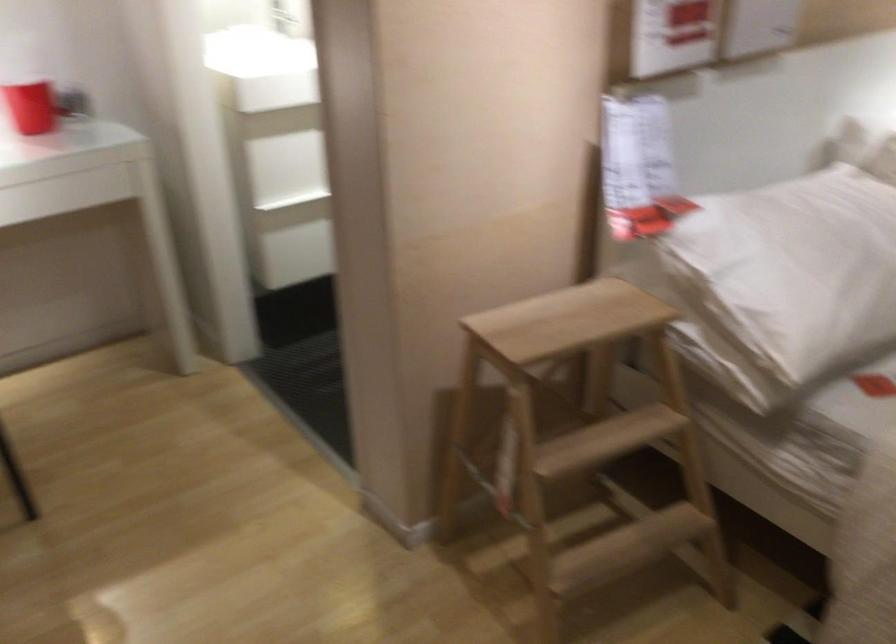
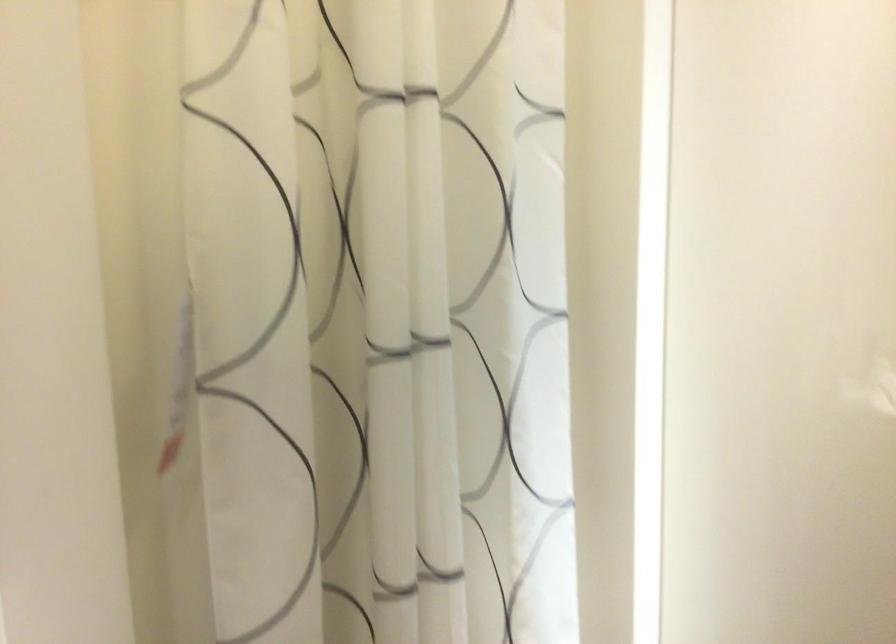
Question: In a continuous first-person perspective shot, in which direction is the camera moving?

Choices:
 (A) Left
 (B) Right
 (C) Forward
 (D) Backward

Answer: (C)